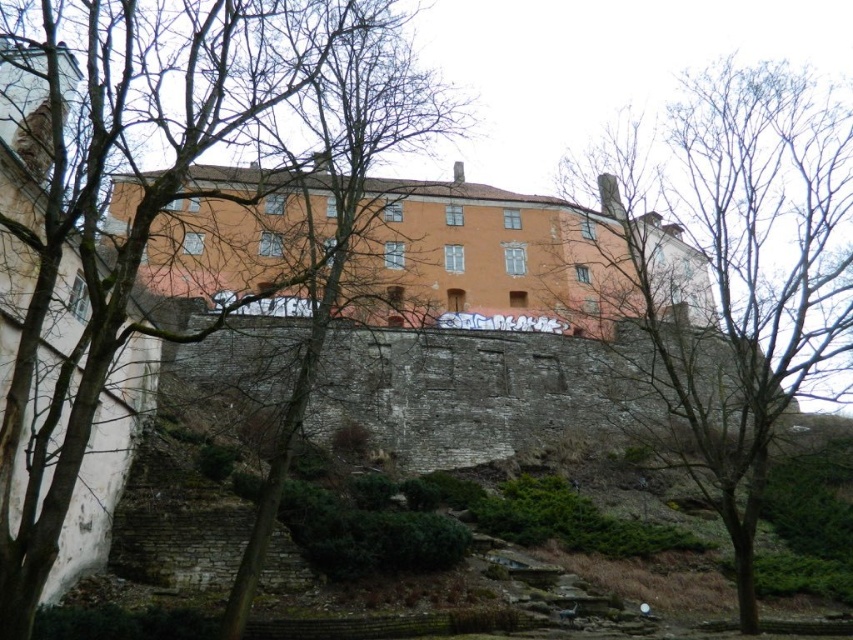
In the scene shown: Does bare branches at center appear on the right side of bare branches at upper center?

In fact, bare branches at center is to the left of bare branches at upper center.

Looking at this image, is bare branches at center closer to the viewer compared to bare branches at upper center?

Yes, bare branches at center is closer to the viewer.

Where is `bare branches at center`? bare branches at center is located at coordinates (183, 177).

Identify the location of bare branches at center. (183, 177).